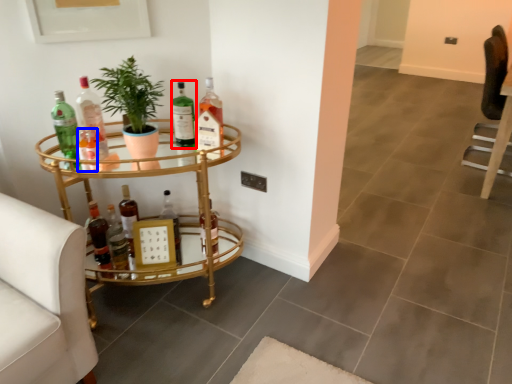
Question: Among these objects, which one is nearest to the camera, bottle (highlighted by a red box) or bottle (highlighted by a blue box)?

Choices:
 (A) bottle
 (B) bottle

Answer: (B)